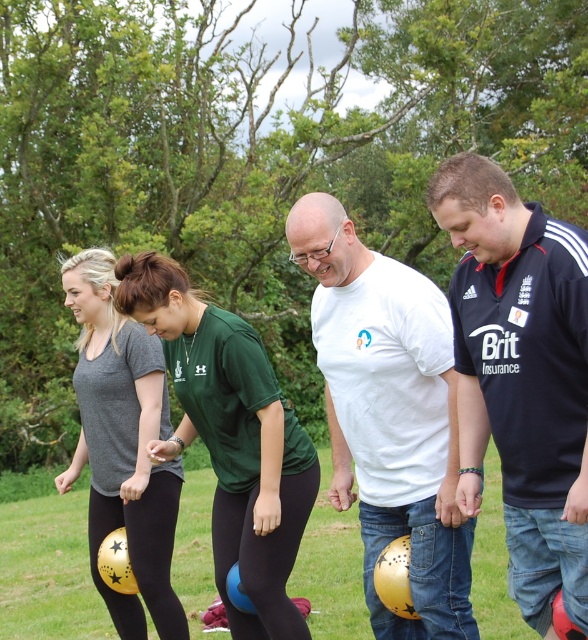
Between white matte t-shirt at center and green matte shirt at center, which one appears on the left side from the viewer's perspective?

From the viewer's perspective, green matte shirt at center appears more on the left side.

Can you confirm if white matte t-shirt at center is positioned to the right of green matte shirt at center?

Yes, white matte t-shirt at center is to the right of green matte shirt at center.

Who is more distant from viewer, (313, 252) or (145, 276)?

Point (145, 276)

This screenshot has height=640, width=588. What are the coordinates of `white matte t-shirt at center` in the screenshot? It's located at (389, 413).

Is white matte t-shirt at center taller than matte gray t-shirt at center?

In fact, white matte t-shirt at center may be shorter than matte gray t-shirt at center.

Is white matte t-shirt at center bigger than matte gray t-shirt at center?

No.

What do you see at coordinates (389, 413) in the screenshot? I see `white matte t-shirt at center` at bounding box center [389, 413].

Locate an element on the screen. The image size is (588, 640). white matte t-shirt at center is located at coordinates point(389,413).

Can you confirm if dark blue jersey at center is positioned below white matte t-shirt at center?

Incorrect, dark blue jersey at center is not positioned below white matte t-shirt at center.

Identify the location of dark blue jersey at center. (522, 376).

Which is behind, point (505, 369) or point (352, 412)?

Point (352, 412)

The height and width of the screenshot is (640, 588). Find the location of `dark blue jersey at center`. dark blue jersey at center is located at coordinates (522, 376).